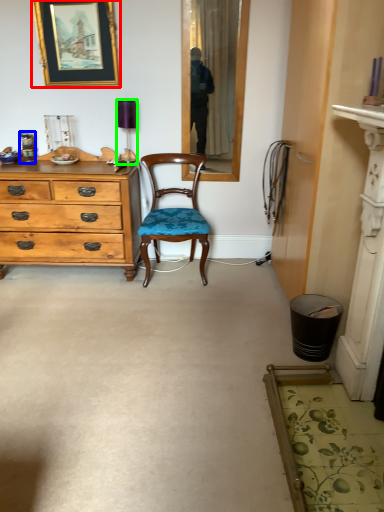
Question: Considering the real-world distances, which object is farthest from picture frame (highlighted by a red box)? bottle (highlighted by a blue box) or lamp (highlighted by a green box)?

Choices:
 (A) bottle
 (B) lamp

Answer: (A)